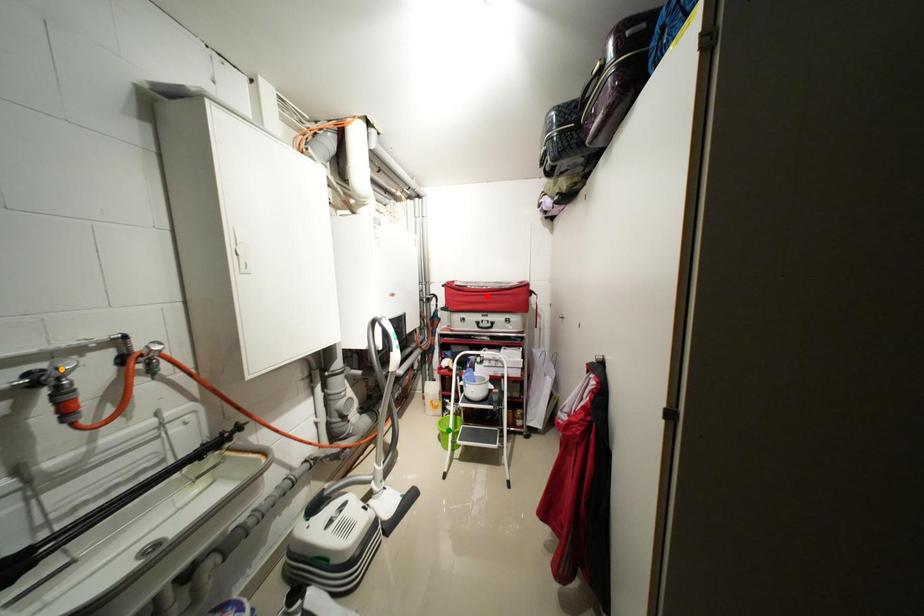
Order these from nearest to farthest:
1. green point
2. red point
3. orange point

orange point → red point → green point